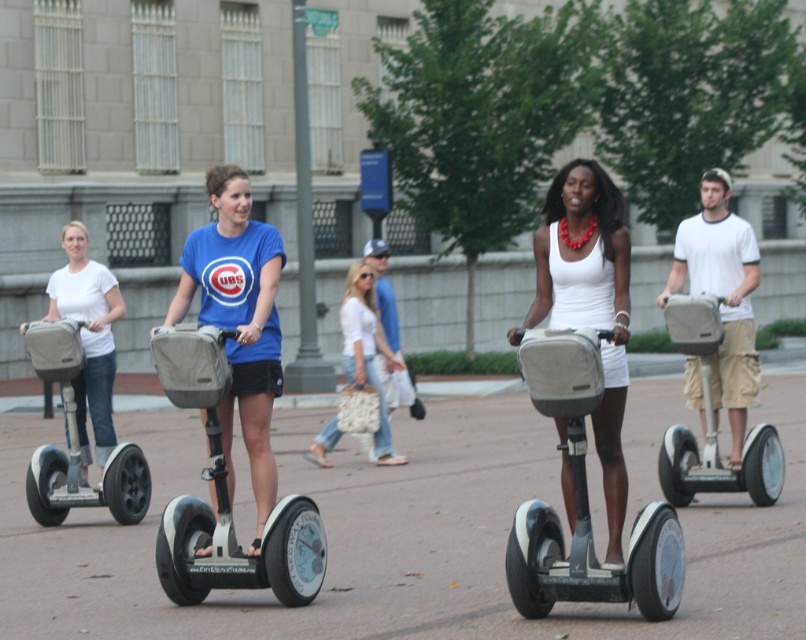
Can you confirm if matte blue shirt at center is positioned below white matte shirt at left?

Yes, matte blue shirt at center is below white matte shirt at left.

Can you confirm if matte blue shirt at center is shorter than white matte shirt at left?

In fact, matte blue shirt at center may be taller than white matte shirt at left.

Is point (244, 396) farther from camera compared to point (106, 321)?

No, (244, 396) is closer to viewer.

Locate an element on the screen. The width and height of the screenshot is (806, 640). matte blue shirt at center is located at coordinates (239, 321).

Is white matte segway at center bigger than white matte shirt at left?

Correct, white matte segway at center is larger in size than white matte shirt at left.

Who is higher up, white matte segway at center or white matte shirt at left?

white matte shirt at left

Describe the element at coordinates (226, 496) in the screenshot. The width and height of the screenshot is (806, 640). I see `white matte segway at center` at that location.

Where is `white matte segway at center`? The image size is (806, 640). white matte segway at center is located at coordinates (226, 496).

Who is shorter, white cotton shirt at center or white matte shirt at left?

white matte shirt at left is shorter.

Can you confirm if white cotton shirt at center is positioned below white matte shirt at left?

Incorrect, white cotton shirt at center is not positioned below white matte shirt at left.

You are a GUI agent. You are given a task and a screenshot of the screen. Output one action in this format:
    pyautogui.click(x=<x>, y=<y>)
    Task: Click on the white cotton shirt at center
    This screenshot has width=806, height=640.
    Given the screenshot: What is the action you would take?
    pyautogui.click(x=721, y=294)